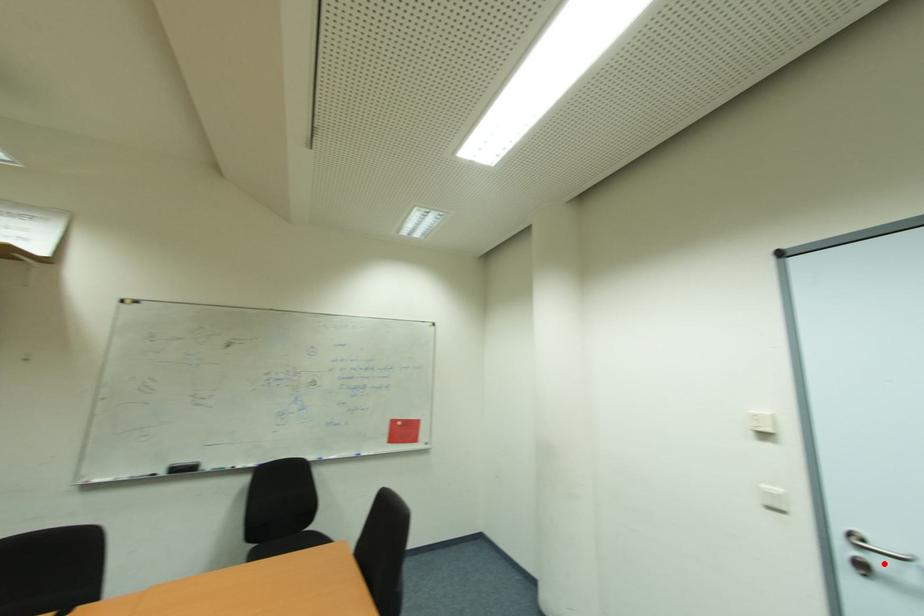
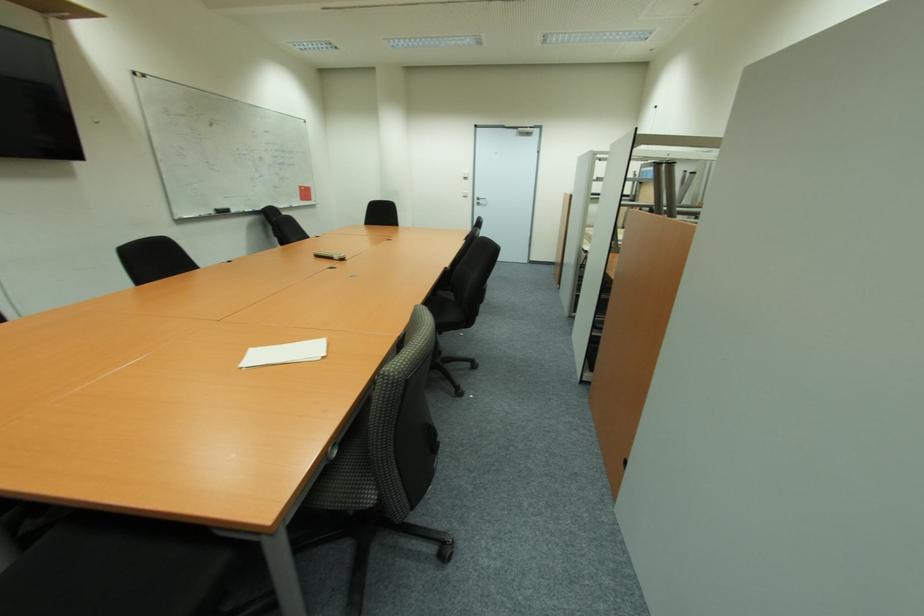
Where in the second image is the point corresponding to the highlighted location from the first image?

(483, 203)